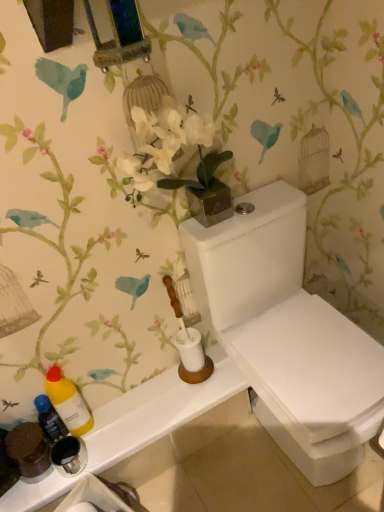
This screenshot has width=384, height=512. In order to click on vacant space to the left of white ceramic toilet brush at center in this screenshot , I will do click(161, 392).